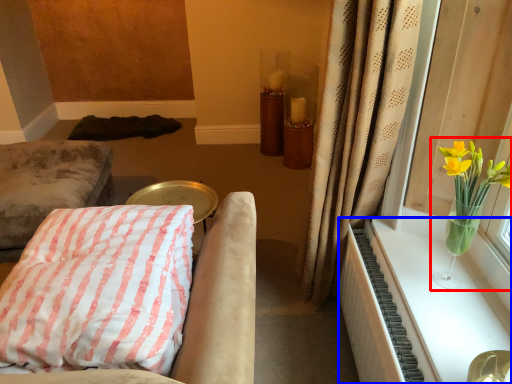
Question: Which point is further to the camera, floral arrangement (highlighted by a red box) or radiator (highlighted by a blue box)?

Choices:
 (A) floral arrangement
 (B) radiator

Answer: (A)